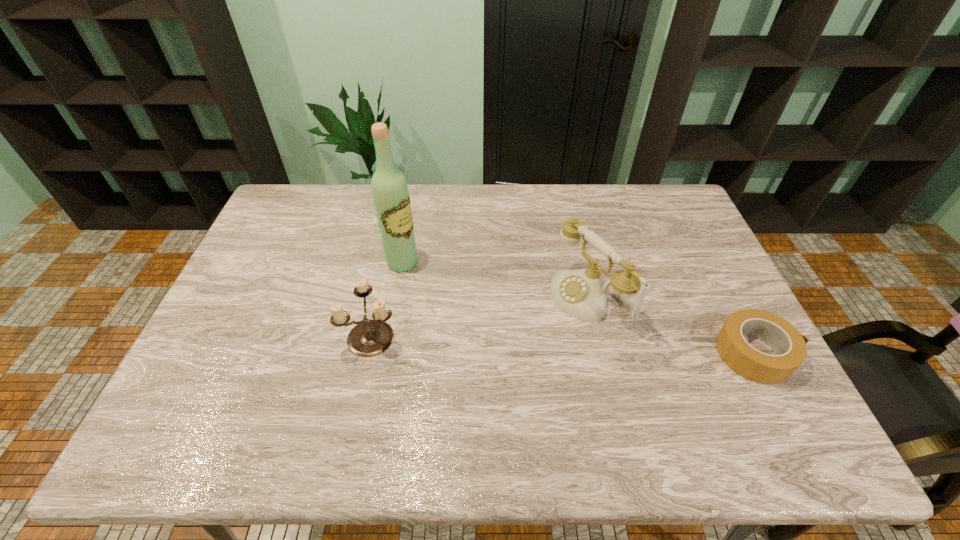
Where is `free location located on the front-facing side of the tallest object`? The image size is (960, 540). free location located on the front-facing side of the tallest object is located at coordinates (514, 331).

Find the location of `free point located 0.320m on the front-facing side of the tallest object`. free point located 0.320m on the front-facing side of the tallest object is located at coordinates (496, 320).

You are a GUI agent. You are given a task and a screenshot of the screen. Output one action in this format:
    pyautogui.click(x=<x>, y=<y>)
    Task: Click on the object present at the near edge
    This screenshot has width=960, height=540.
    Given the screenshot: What is the action you would take?
    pyautogui.click(x=789, y=345)

The height and width of the screenshot is (540, 960). Identify the location of object located in the right edge section of the desktop. (789, 345).

You are a GUI agent. You are given a task and a screenshot of the screen. Output one action in this format:
    pyautogui.click(x=<x>, y=<y>)
    Task: Click on the object that is at the near right corner
    The width and height of the screenshot is (960, 540).
    Given the screenshot: What is the action you would take?
    pyautogui.click(x=789, y=345)

Find the location of a particular element. Image resolution: width=960 pixels, height=540 pixels. free space at the far edge of the desktop is located at coordinates (466, 222).

Locate an element on the screen. free space at the near edge of the desktop is located at coordinates (708, 394).

Where is `free region at the left edge of the desktop`? free region at the left edge of the desktop is located at coordinates (221, 327).

The image size is (960, 540). In order to click on vacant area at the right edge in this screenshot , I will do `click(693, 227)`.

At what (x,y) coordinates should I click in order to perform the action: click on vacant space at the far left corner of the desktop. Please return your answer as a coordinate pair (x, y). The image size is (960, 540). Looking at the image, I should click on pos(299,183).